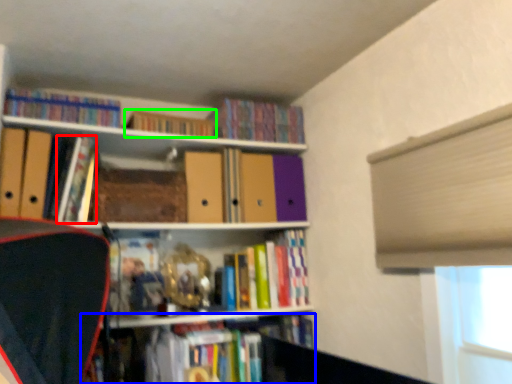
Question: Considering the real-world distances, which object is closest to book (highlighted by a red box)? book (highlighted by a blue box) or book (highlighted by a green box).

Choices:
 (A) book
 (B) book

Answer: (B)